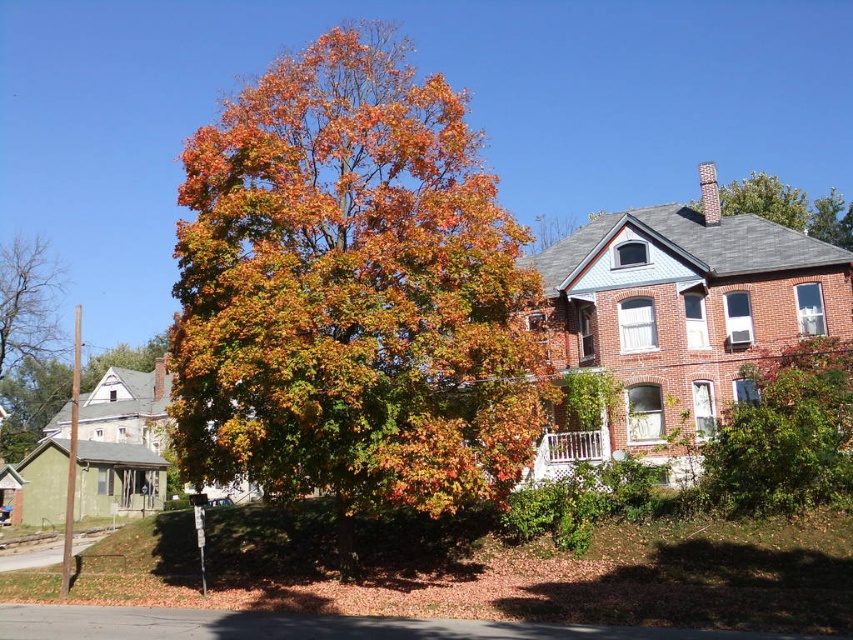
Question: In this image, where is multicolored foliage at center located relative to bare branches at left?

Choices:
 (A) above
 (B) below

Answer: (A)

Question: Which point appears closest to the camera in this image?

Choices:
 (A) (480, 212)
 (B) (33, 273)

Answer: (A)

Question: Is multicolored foliage at center behind bare branches at left?

Choices:
 (A) no
 (B) yes

Answer: (A)

Question: Which of the following is the closest to the observer?

Choices:
 (A) [299, 340]
 (B) [0, 324]

Answer: (A)

Question: Which point is closer to the camera?

Choices:
 (A) (202, 465)
 (B) (3, 340)

Answer: (A)

Question: Does multicolored foliage at center appear over bare branches at left?

Choices:
 (A) yes
 (B) no

Answer: (A)